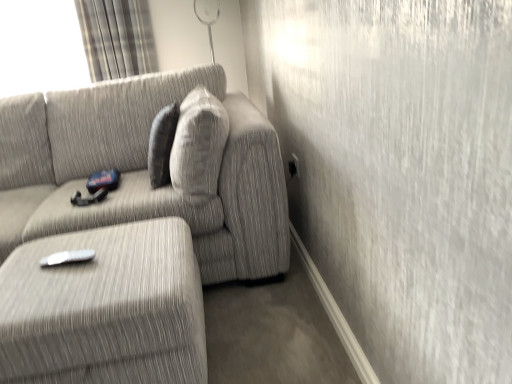
You are a GUI agent. You are given a task and a screenshot of the screen. Output one action in this format:
    pyautogui.click(x=<x>, y=<y>)
    Task: Click on the vacant space behind white plastic remote at lower left
    The width and height of the screenshot is (512, 384).
    Given the screenshot: What is the action you would take?
    pyautogui.click(x=84, y=239)